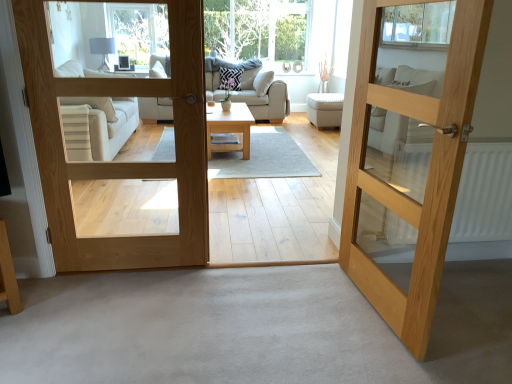
Question: Is light wood coffee table at center bigger than beige fabric studio couch at center?

Choices:
 (A) no
 (B) yes

Answer: (A)

Question: From a real-world perspective, is light wood coffee table at center under beige fabric studio couch at center?

Choices:
 (A) yes
 (B) no

Answer: (A)

Question: Does light wood coffee table at center lie behind beige fabric studio couch at center?

Choices:
 (A) yes
 (B) no

Answer: (B)

Question: Could you tell me if light wood coffee table at center is facing beige fabric studio couch at center?

Choices:
 (A) no
 (B) yes

Answer: (A)

Question: Is light wood coffee table at center in contact with beige fabric studio couch at center?

Choices:
 (A) yes
 (B) no

Answer: (B)

Question: Based on their positions, is clear glass window at upper center located to the left or right of natural wood door at center, which is the 2th door in left-to-right order?

Choices:
 (A) right
 (B) left

Answer: (B)

Question: In terms of width, does clear glass window at upper center look wider or thinner when compared to natural wood door at center, which is the 2th door in left-to-right order?

Choices:
 (A) wide
 (B) thin

Answer: (A)

Question: From their relative heights in the image, would you say clear glass window at upper center is taller or shorter than natural wood door at center, the first door viewed from the right?

Choices:
 (A) short
 (B) tall

Answer: (A)

Question: Is clear glass window at upper center in front of or behind natural wood door at center, which is the 2th door in left-to-right order, in the image?

Choices:
 (A) behind
 (B) front

Answer: (A)

Question: Considering the positions of clear glass window at upper center and light wood coffee table at center in the image, is clear glass window at upper center wider or thinner than light wood coffee table at center?

Choices:
 (A) thin
 (B) wide

Answer: (A)

Question: Is clear glass window at upper center bigger or smaller than light wood coffee table at center?

Choices:
 (A) big
 (B) small

Answer: (A)

Question: In the image, is clear glass window at upper center on the left side or the right side of light wood coffee table at center?

Choices:
 (A) left
 (B) right

Answer: (A)

Question: Is clear glass window at upper center inside or outside of light wood coffee table at center?

Choices:
 (A) outside
 (B) inside

Answer: (A)

Question: In the image, is white textured radiator at right positioned in front of or behind natural wood door at center, which is the 2th door in left-to-right order?

Choices:
 (A) front
 (B) behind

Answer: (B)

Question: Looking at their shapes, would you say white textured radiator at right is wider or thinner than natural wood door at center, the first door viewed from the right?

Choices:
 (A) wide
 (B) thin

Answer: (A)